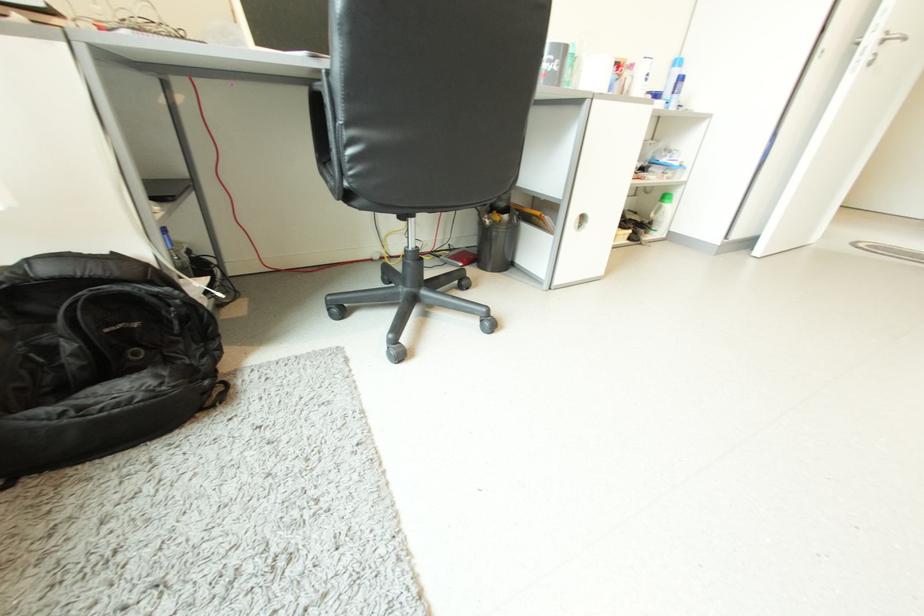
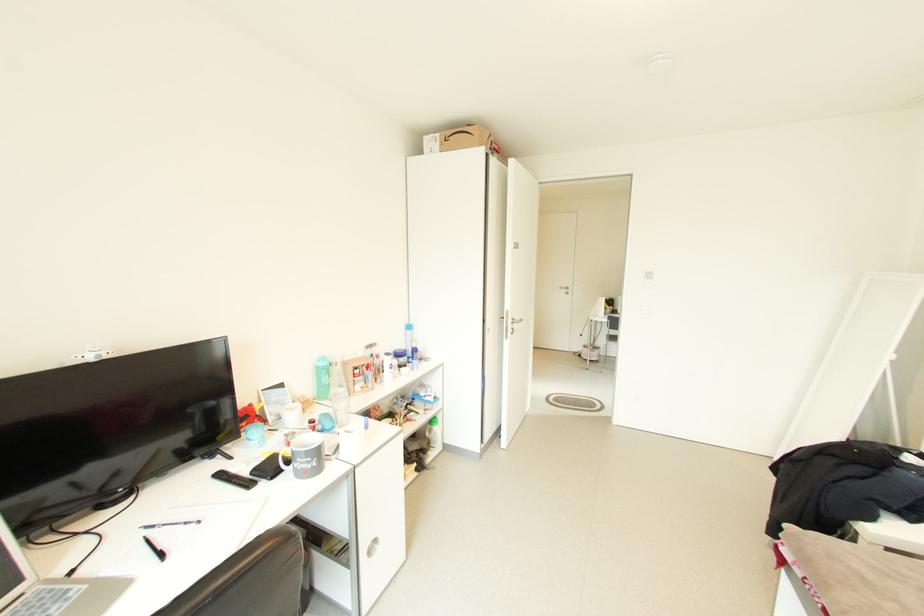
Where in the second image is the point corresponding to (886,41) from the first image?

(518, 323)